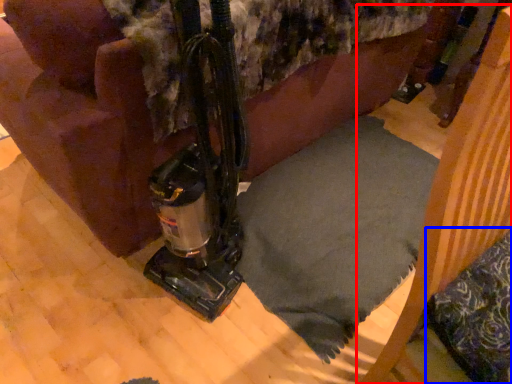
Question: Which point is closer to the camera, furniture (highlighted by a red box) or pillow (highlighted by a blue box)?

Choices:
 (A) furniture
 (B) pillow

Answer: (A)